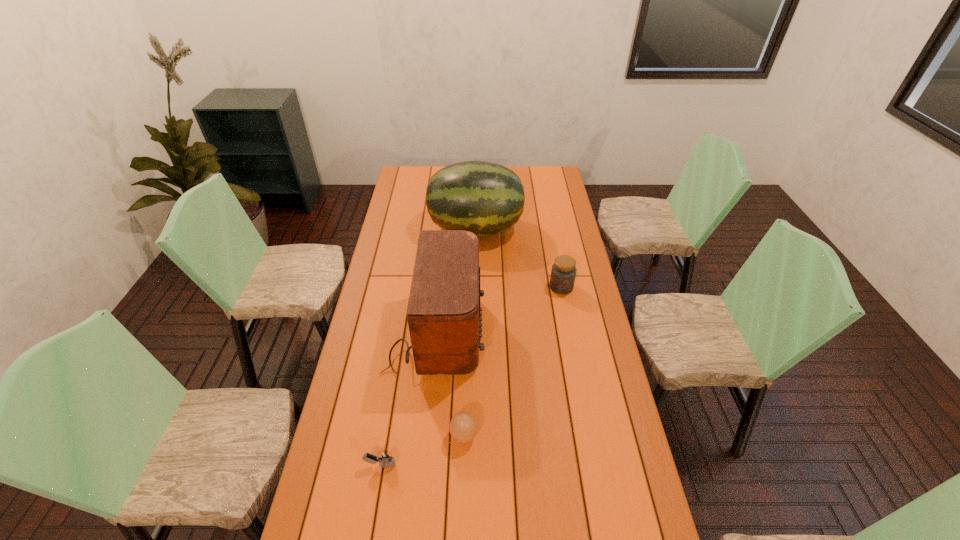
Where is `watermelon`? watermelon is located at coordinates (485, 198).

At what (x,y) coordinates should I click in order to perform the action: click on radio receiver. Please return your answer as a coordinate pair (x, y). The image size is (960, 540). Looking at the image, I should click on (444, 319).

This screenshot has width=960, height=540. Identify the location of the third shortest object. (563, 273).

You are a GUI agent. You are given a task and a screenshot of the screen. Output one action in this format:
    pyautogui.click(x=<x>, y=<y>)
    Task: Click on the rightmost object
    This screenshot has height=540, width=960.
    Given the screenshot: What is the action you would take?
    pyautogui.click(x=563, y=273)

This screenshot has height=540, width=960. I want to click on the fourth tallest object, so click(463, 426).

You are a GUI agent. You are given a task and a screenshot of the screen. Output one action in this format:
    pyautogui.click(x=<x>, y=<y>)
    Task: Click on the second nearest object
    Image resolution: width=960 pixels, height=540 pixels.
    Given the screenshot: What is the action you would take?
    pyautogui.click(x=463, y=426)

Find the location of `igniter`. igniter is located at coordinates (386, 460).

Locate an element on the screen. The image size is (960, 540). the nearest object is located at coordinates (386, 460).

This screenshot has height=540, width=960. What are the coordinates of `free space located 0.080m on the front of the watermelon` in the screenshot? It's located at (475, 264).

Identify the location of free location located on the front panel of the radio receiver. Image resolution: width=960 pixels, height=540 pixels. (542, 333).